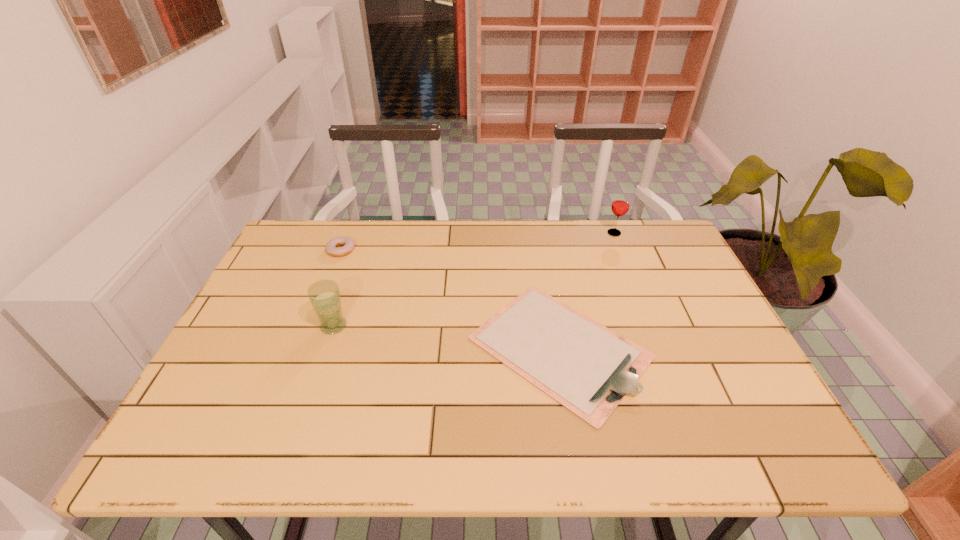
Locate an element on the screen. free space between the clipboard and the doughnut is located at coordinates (450, 299).

At what (x,y) coordinates should I click in order to perform the action: click on object that is the closest one to the nearer glass. Please return your answer as a coordinate pair (x, y). The height and width of the screenshot is (540, 960). Looking at the image, I should click on (347, 243).

Select which object appears as the second closest to the farther glass. Please provide its 2D coordinates. Your answer should be formatted as a tuple, i.e. [(x, y)], where the tuple contains the x and y coordinates of a point satisfying the conditions above.

[(347, 243)]

Where is `free space that satisfies the following two spatial constraints: 1. on the back side of the farther glass; 2. on the left side of the doughnut`? This screenshot has width=960, height=540. free space that satisfies the following two spatial constraints: 1. on the back side of the farther glass; 2. on the left side of the doughnut is located at coordinates (348, 233).